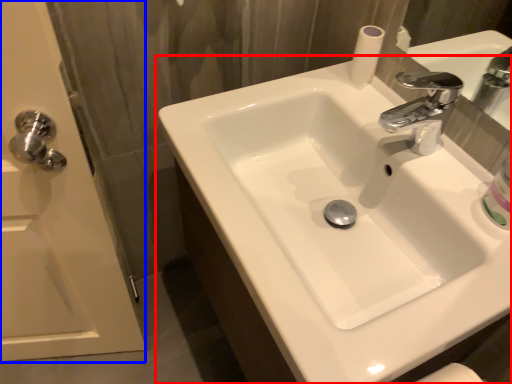
Question: Among these objects, which one is nearest to the camera, sink (highlighted by a red box) or screen door (highlighted by a blue box)?

Choices:
 (A) sink
 (B) screen door

Answer: (A)